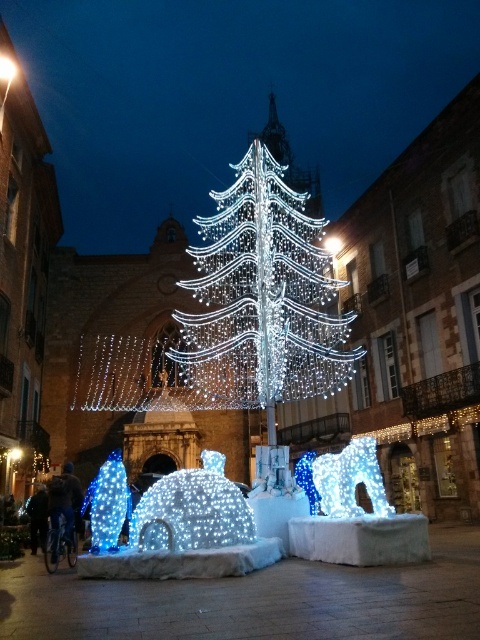
Question: Among these objects, which one is farthest from the camera?

Choices:
 (A) blue led lights at left
 (B) illuminated wireframe tree at center
 (C) icy white sculpture at center

Answer: (B)

Question: Among these objects, which one is farthest from the camera?

Choices:
 (A) illuminated wireframe tree at center
 (B) icy white dome at center
 (C) blue led lights at left

Answer: (A)

Question: Which object is positioned closest to the icy white sculpture at center?

Choices:
 (A) illuminated wireframe tree at center
 (B) blue led lights at left
 (C) icy white dome at center

Answer: (C)

Question: Is icy white sculpture at center wider than blue led lights at left?

Choices:
 (A) no
 (B) yes

Answer: (A)

Question: Is illuminated wireframe tree at center bigger than icy white sculpture at center?

Choices:
 (A) no
 (B) yes

Answer: (B)

Question: Observing the image, what is the correct spatial positioning of icy white dome at center in reference to icy white sculpture at center?

Choices:
 (A) left
 (B) right

Answer: (A)